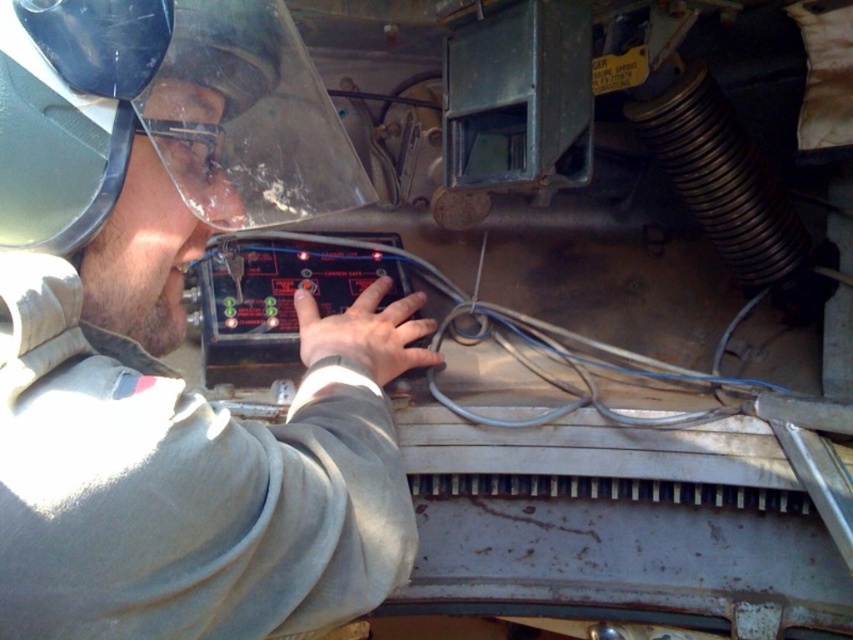
You are an inspector checking the machinery. You notice the matte black control panel at center and the transparent plastic goggles at upper center. Which object is located to the right of the other?

The matte black control panel at center is positioned on the right side of transparent plastic goggles at upper center.

You are a technician standing at the center of the machinery. You need to locate the matte black control panel at center. According to the coordinates provided, where exactly should you look to find it?

The matte black control panel at center is located at coordinates point (170, 349).